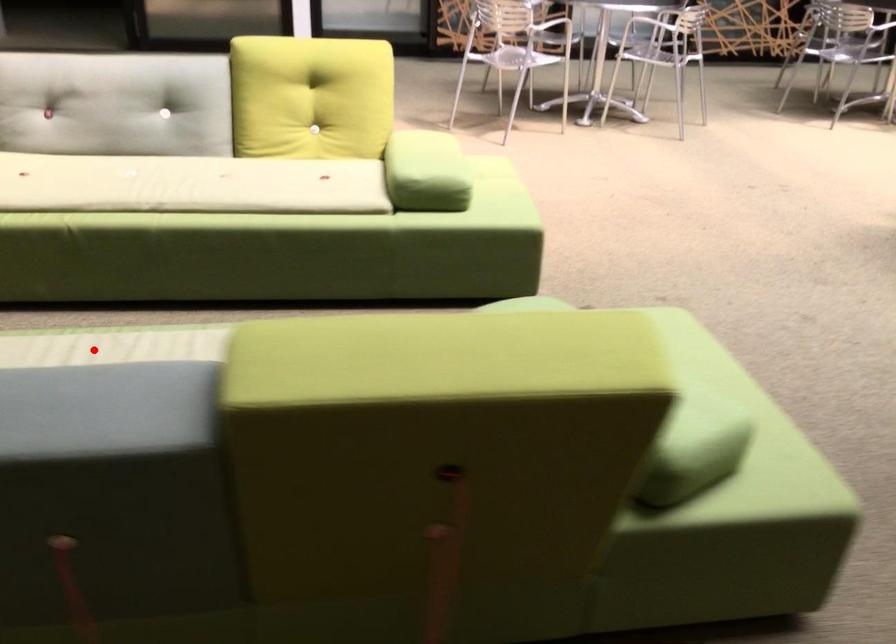
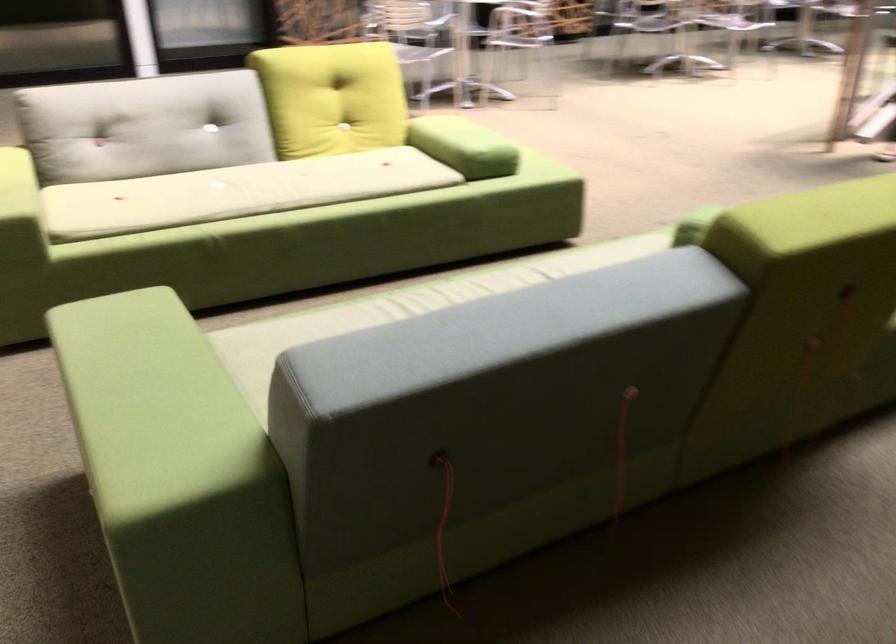
The point at the highlighted location is marked in the first image. Where is the corresponding point in the second image?

(401, 308)